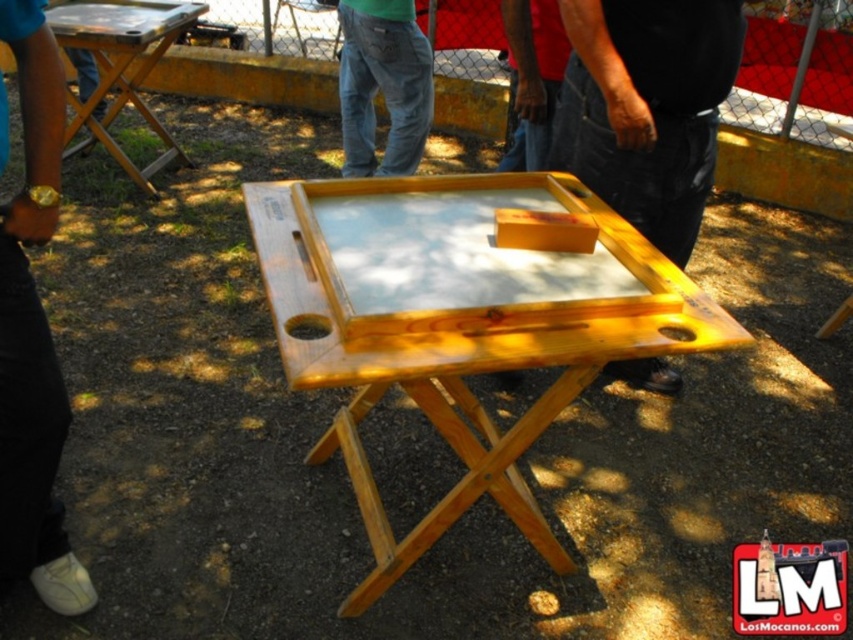
Question: Which point is farther to the camera?

Choices:
 (A) black leather wristwatch at lower left
 (B) wooden table at center

Answer: (B)

Question: Considering the relative positions of wooden table at center and wooden folding table at upper left in the image provided, where is wooden table at center located with respect to wooden folding table at upper left?

Choices:
 (A) below
 (B) above

Answer: (A)

Question: Is black leather wristwatch at lower left to the right of wooden folding table at upper left from the viewer's perspective?

Choices:
 (A) no
 (B) yes

Answer: (B)

Question: Which object is the closest to the black leather wristwatch at lower left?

Choices:
 (A) light brown wood table at center
 (B) wooden table at center
 (C) denim pants at center

Answer: (A)

Question: Which point appears closest to the camera in this image?

Choices:
 (A) (119, 6)
 (B) (544, 260)

Answer: (B)

Question: Does wooden table at center lie behind denim pants at center?

Choices:
 (A) yes
 (B) no

Answer: (B)